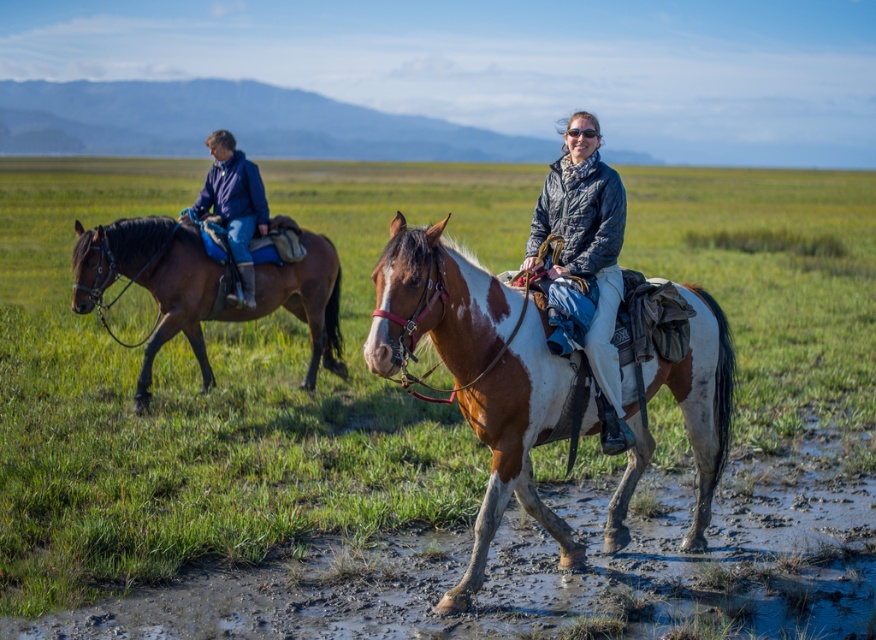
You are a photographer trying to capture a clear shot of the brown speckled horse at center and the matte gray jacket at center. Which object should you focus on if you want to highlight the one that is taller?

The brown speckled horse at center is taller than the matte gray jacket at center, so you should focus on the brown speckled horse at center to highlight its height.

You are standing in the field and want to reach the point marked at coordinates point (26, 320). If you walk straight ahead, will you reach that point before the horse with the white and brown coat passes by you?

The point (26, 320) is 14.34 meters away from the viewer. Since the horse with the white and brown coat is in the foreground, it is closer to you. Therefore, the horse will pass by you before you reach the point (26, 320).

Based on the photo, you are a photographer trying to capture a photo of both the brown speckled horse at center and the matte gray jacket at center. Based on their positions, which one should you focus on first to ensure both are in the frame?

The brown speckled horse at center is positioned on the left side of matte gray jacket at center, so you should focus on the matte gray jacket at center first to ensure both are in the frame.